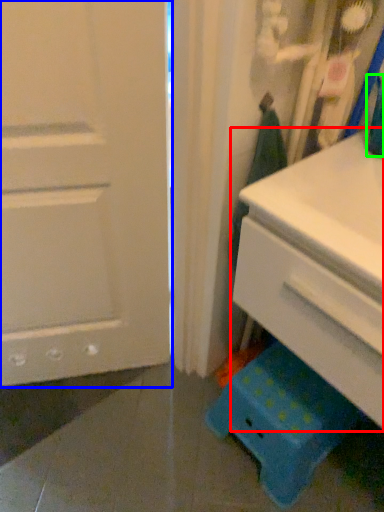
Question: Based on their relative distances, which object is farther from chest of drawers (highlighted by a red box)? Choose from door (highlighted by a blue box) and teal (highlighted by a green box).

Choices:
 (A) door
 (B) teal

Answer: (A)